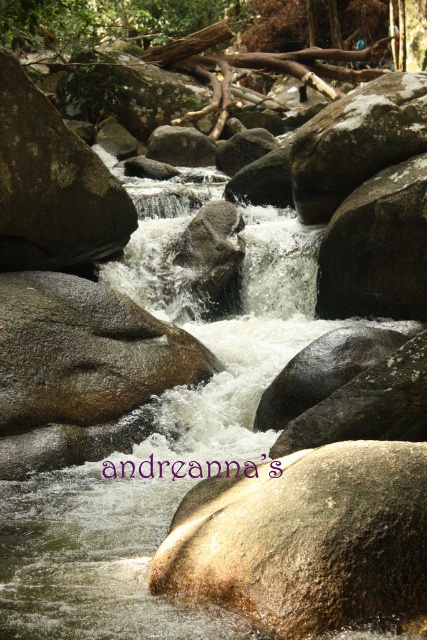
In the scene shown: Does brown rough rock at center have a larger size compared to matte brown rock at upper left?

No.

Does point (146, 349) come farther from viewer compared to point (31, 156)?

That is False.

At what (x,y) coordinates should I click in order to perform the action: click on brown rough rock at center. Please return your answer as a coordinate pair (x, y). Looking at the image, I should click on (84, 353).

Does point (64, 324) lie in front of point (385, 333)?

No, (64, 324) is further to viewer.

Identify the location of brown rough rock at center. (84, 353).

Is dark gray stone at center to the left of shiny dark brown rock at center from the viewer's perspective?

In fact, dark gray stone at center is to the right of shiny dark brown rock at center.

Which is behind, point (403, 272) or point (388, 337)?

The point (403, 272) is more distant.

Is point (426, 182) positioned before point (336, 362)?

No, it is not.

Locate an element on the screen. The image size is (427, 640). dark gray stone at center is located at coordinates (377, 248).